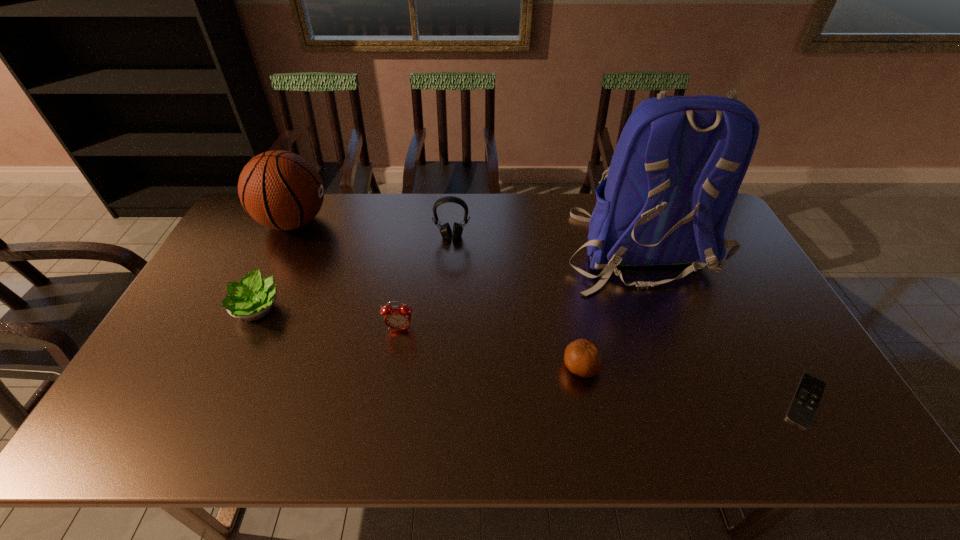
Identify the location of backpack. The image size is (960, 540). (676, 170).

Where is `the sixth shortest object`? the sixth shortest object is located at coordinates (281, 190).

I want to click on headset, so click(x=445, y=230).

Find the location of a particular element. The height and width of the screenshot is (540, 960). the third tallest object is located at coordinates (445, 230).

Find the location of a particular element. This screenshot has width=960, height=540. the fourth tallest object is located at coordinates (396, 317).

Locate an element on the screen. The image size is (960, 540). the third object from left to right is located at coordinates (396, 317).

At what (x,y) coordinates should I click in order to perform the action: click on lettuce. Please return your answer as a coordinate pair (x, y). Image resolution: width=960 pixels, height=540 pixels. Looking at the image, I should click on (252, 298).

Locate an element on the screen. clementine is located at coordinates (582, 357).

The width and height of the screenshot is (960, 540). Identify the location of remote control. (804, 405).

Find the location of `blank space located on the back of the backpack`. blank space located on the back of the backpack is located at coordinates (677, 351).